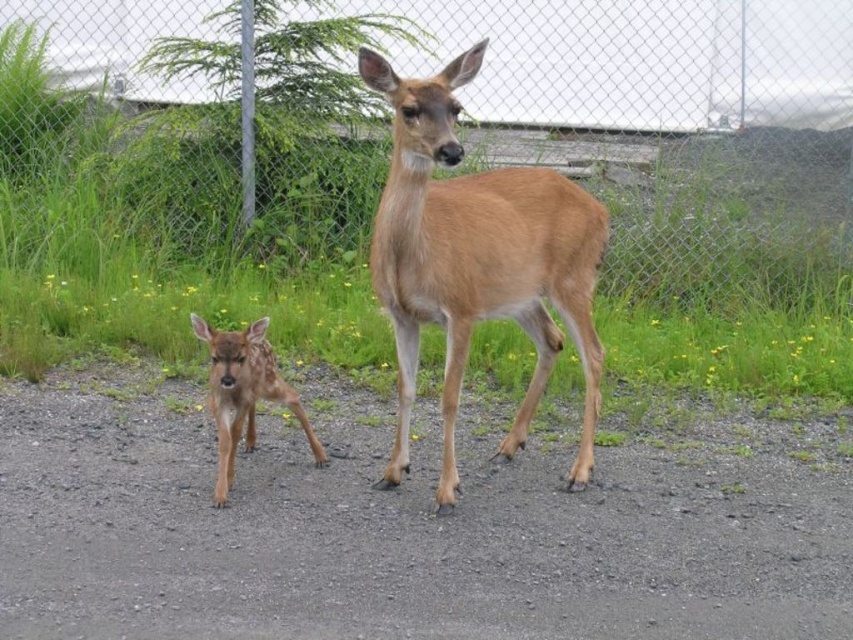
Describe the element at coordinates (477, 259) in the screenshot. The height and width of the screenshot is (640, 853). I see `light brown fur at center` at that location.

Can you confirm if light brown fur at center is shorter than spotted fur fawn at lower left?

No, light brown fur at center is not shorter than spotted fur fawn at lower left.

Which is in front, point (570, 240) or point (248, 337)?

Positioned in front is point (248, 337).

The image size is (853, 640). In order to click on light brown fur at center in this screenshot , I will do `click(477, 259)`.

Is wire mesh fence at upper center further to the viewer compared to light brown fur at center?

Yes, it is.

Image resolution: width=853 pixels, height=640 pixels. What do you see at coordinates (596, 122) in the screenshot? I see `wire mesh fence at upper center` at bounding box center [596, 122].

Image resolution: width=853 pixels, height=640 pixels. In order to click on wire mesh fence at upper center in this screenshot , I will do `click(596, 122)`.

Is point (527, 29) positioned in front of point (230, 381)?

That is False.

Is wire mesh fence at upper center bigger than spotted fur fawn at lower left?

Indeed, wire mesh fence at upper center has a larger size compared to spotted fur fawn at lower left.

Between point (329, 10) and point (283, 390), which one is positioned in front?

Point (283, 390)

Where is `wire mesh fence at upper center`? wire mesh fence at upper center is located at coordinates (596, 122).